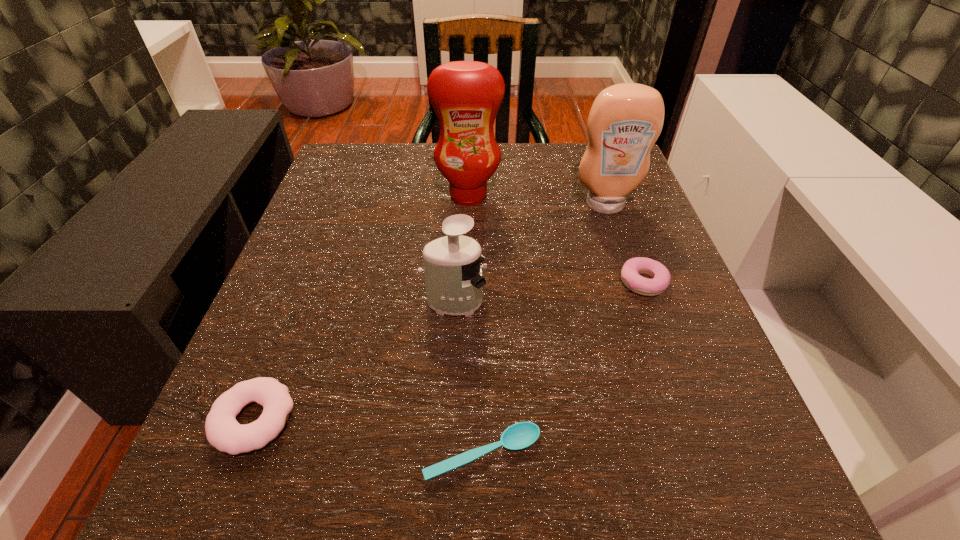
You are a GUI agent. You are given a task and a screenshot of the screen. Output one action in this format:
    pyautogui.click(x=<x>, y=<y>)
    Task: Click on the free space at the near edge of the desktop
    This screenshot has width=960, height=540.
    Given the screenshot: What is the action you would take?
    pyautogui.click(x=497, y=484)

At what (x,y) coordinates should I click in order to perform the action: click on vacant space at the left edge of the desktop. Please return your answer as a coordinate pair (x, y). Looking at the image, I should click on (353, 286).

The width and height of the screenshot is (960, 540). In the image, there is a desktop. Identify the location of vacant area at the right edge. click(614, 245).

Locate an element on the screen. The width and height of the screenshot is (960, 540). vacant space at the far left corner of the desktop is located at coordinates (320, 192).

The width and height of the screenshot is (960, 540). Find the location of `vacant area at the near right corner`. vacant area at the near right corner is located at coordinates (757, 481).

Find the location of `empty space between the leftmost object and the pastry`. empty space between the leftmost object and the pastry is located at coordinates (448, 351).

Locate an element on the screen. The image size is (960, 540). free point between the leftmost object and the spoon is located at coordinates (369, 437).

Locate an element on the screen. Image resolution: width=960 pixels, height=540 pixels. vacant area between the leftmost object and the right condiment is located at coordinates (429, 312).

You are a GUI agent. You are given a task and a screenshot of the screen. Output one action in this format:
    pyautogui.click(x=<x>, y=<y>)
    Task: Click on the vacant area that lies between the fourth shortest object and the spoon
    
    Given the screenshot: What is the action you would take?
    pyautogui.click(x=468, y=378)

Where is `free space between the leftmost object and the left condiment`? free space between the leftmost object and the left condiment is located at coordinates (361, 308).